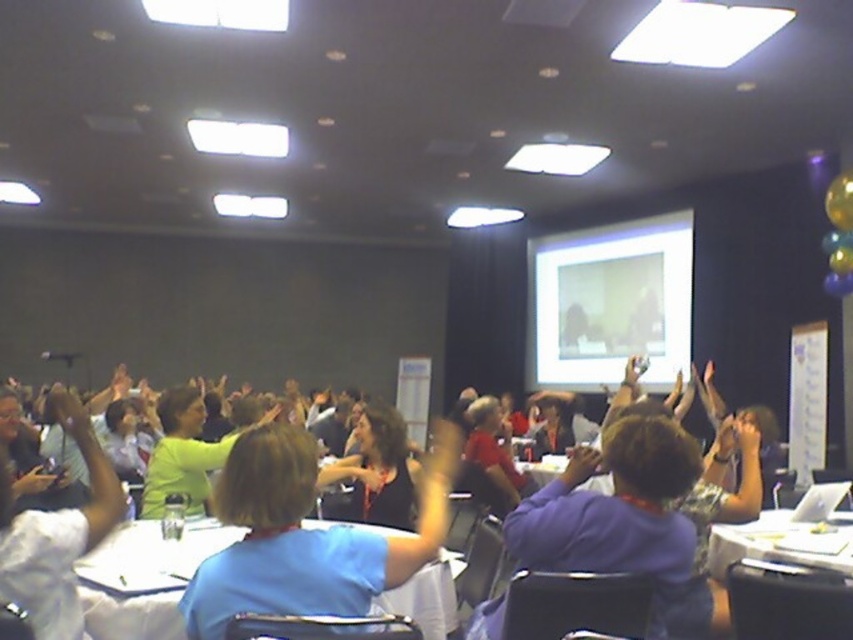
In the scene shown: You are an event organizer standing at the front of the room. You need to hand out a document to the person wearing the blue fabric shirt at center and then to the white plastic table at lower right. How far will you have to walk in total to reach both locations?

The blue fabric shirt at center and white plastic table at lower right are 6.10 feet apart from each other. To reach both locations, you would first walk to the blue fabric shirt at center, then to the white plastic table at lower right, totaling a distance of 6.10 feet.